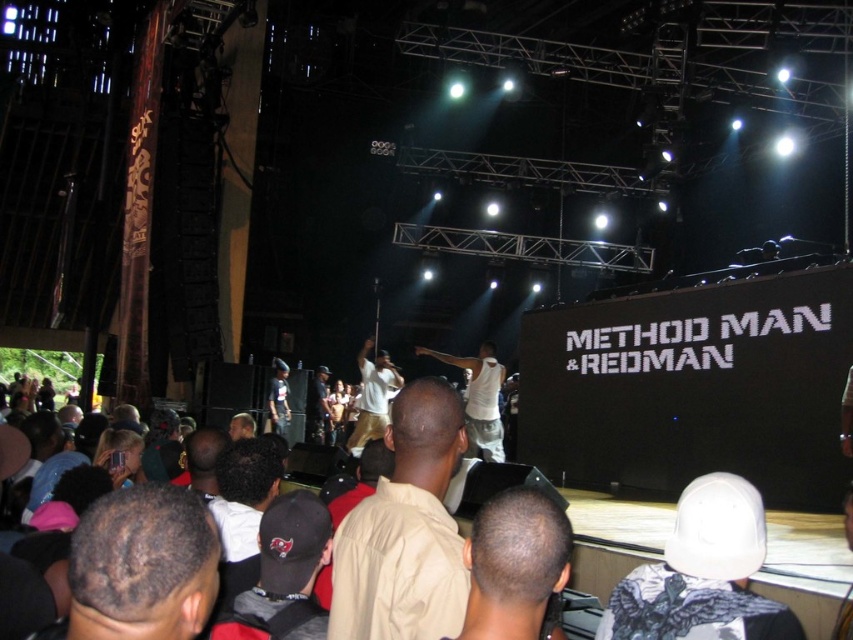
You are a photographer at the concert and want to capture a clear shot of both the tan cotton shirt at center and the dark brown hair at center. Which object should you focus on first to ensure it appears in focus?

The tan cotton shirt at center is taller than dark brown hair at center. Therefore, you should focus on the tan cotton shirt at center first since it is larger and more prominent in the frame.

You are standing at the front of the concert venue and notice a white matte baseball cap at lower right. If you want to reach it without moving through the crowd, can you do so by stepping forward?

The white matte baseball cap at lower right is 6.67 meters away from you. Since you can move forward without needing to go through the crowd, you can reach it by stepping forward.

You are a photographer at the concert and want to capture both the tan cotton shirt at center and the dark brown hair at center in a single photo. Which object should you focus on first to ensure both are in sharp focus?

The tan cotton shirt at center is further to the viewer than the dark brown hair at center. To ensure both are in sharp focus, you should focus on the tan cotton shirt at center first, as it is closer to the camera, and the depth of field will naturally include the darker brown hair at center in the background.